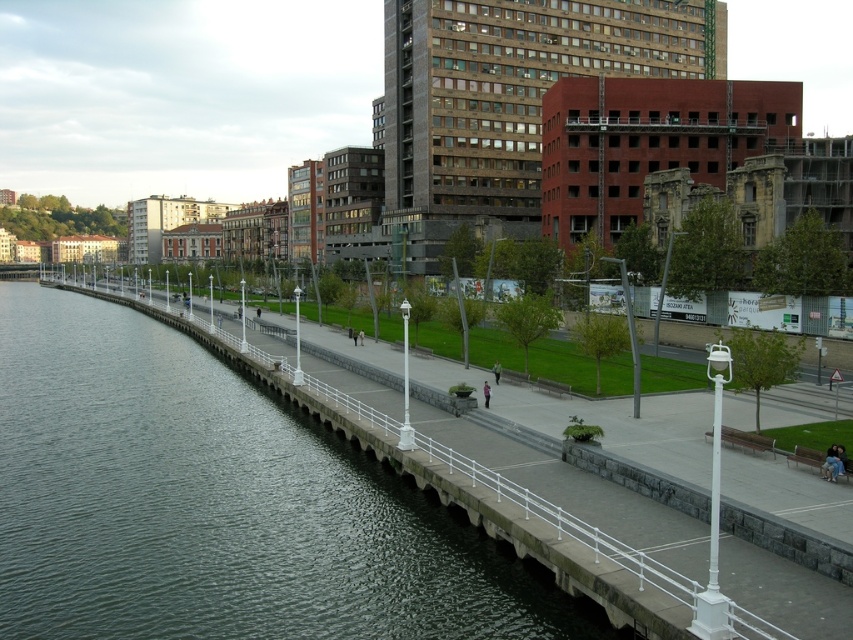
You are standing on the white concrete walkway at lower left and want to reach the pink fabric person at center. Are you closer to the water or the grassy area with trees while walking towards them?

The white concrete walkway at lower left is larger in size than pink fabric person at center, so you are closer to the water while walking towards the pink fabric person at center.

Based on the photo, you are standing at the beginning of the waterfront promenade and want to reach the benches on the grassy area to your right. Which object, the green concrete river at lower left or the white concrete walkway at lower left, should you avoid stepping on to stay safe?

You should avoid stepping on the green concrete river at lower left because it is closer to the viewer than the white concrete walkway at lower left, meaning the river is in front of the walkway and stepping on it might be unsafe.